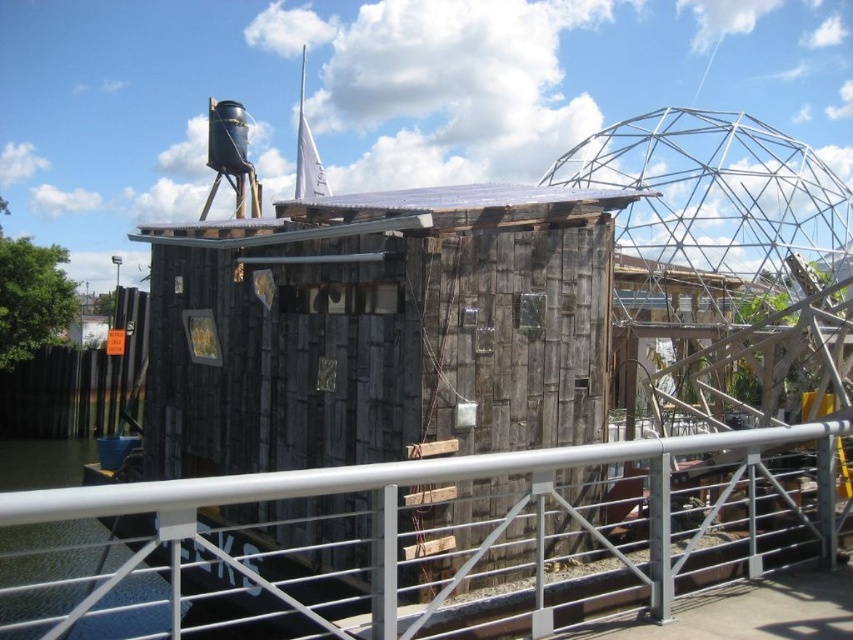
You are standing at the lower center of the image and want to place a small potted plant on the silver metallic rail at lower center. However, you notice the weathered wood hut at center is in the way. Can you still place the plant on the rail without moving the hut?

The weathered wood hut at center is taller than the silver metallic rail at lower center, so the hut might block access to the rail. However, since the rail is at lower center and the hut is taller but presumably positioned centrally, you might still be able to place the plant on the rail by positioning it around or beside the hut.

You are standing at the edge of the water and want to walk to the silver metallic rail at lower center. Which direction should you go relative to the weathered wood hut at center?

You should go to the right of the weathered wood hut at center to reach the silver metallic rail at lower center because the weathered wood hut at center is to the left of the silver metallic rail at lower center.

You are standing at point 0.5, 0.4 in the image. You want to go to the weathered wood hut at center. In which direction should you move?

You should move northeast to reach the weathered wood hut at center because it is located at point (379,330), which is northeast of your current position at (340,320).